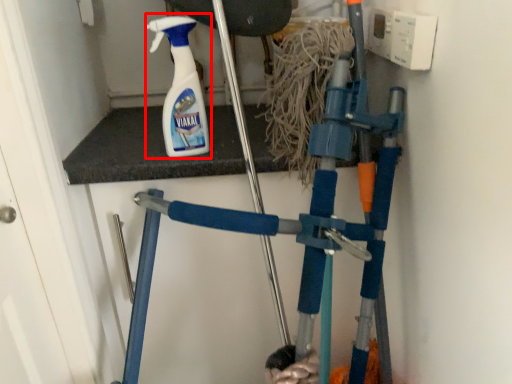
Question: Considering the relative positions of cleaning product (annotated by the red box) and crutch in the image provided, where is cleaning product (annotated by the red box) located with respect to the staircase?

Choices:
 (A) left
 (B) right

Answer: (A)